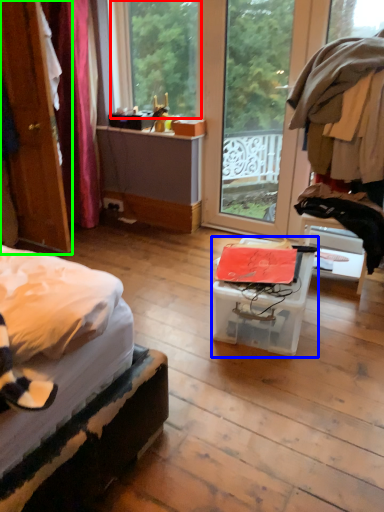
Question: Which is nearer to the window (highlighted by a red box)? box (highlighted by a blue box) or door (highlighted by a green box).

Choices:
 (A) box
 (B) door

Answer: (B)